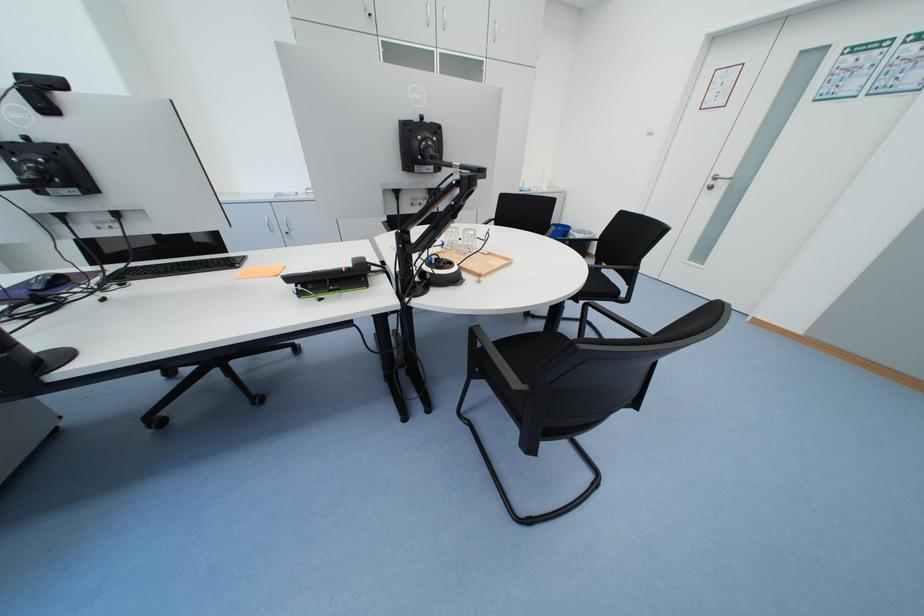
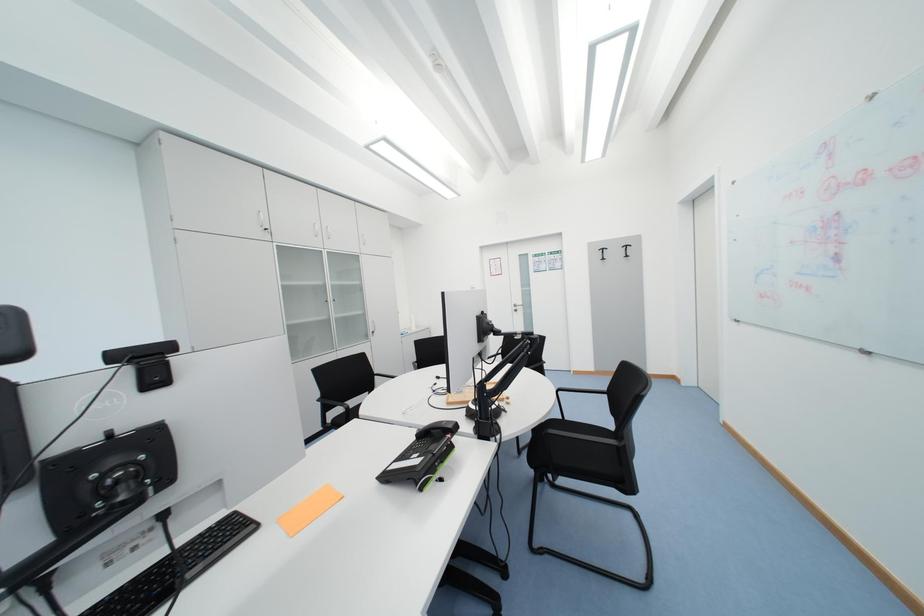
How did the camera likely rotate?

The camera's rotation is toward right-up.